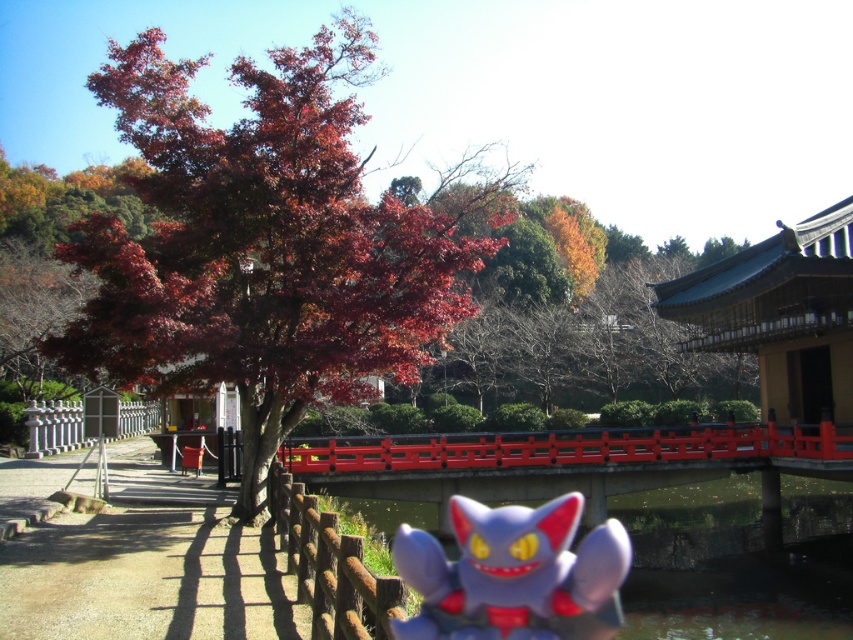
You are standing at the point marked by the coordinates point (x=514, y=573) in the image. What object are you standing on?

You are standing on the plush gray toy at center marked by the coordinates point (x=514, y=573).

You are a visitor walking along the path in the Japanese garden scene. You see the brown wooden fence at lower center and the white glossy fence at left. Which fence is positioned higher relative to your viewpoint?

The brown wooden fence at lower center is located above the white glossy fence at left, so it is positioned higher relative to your viewpoint.

You are a visitor in this Japanese garden and see the plush gray toy at center and the white glossy fence at left. Which object is positioned more to the east if the garden faces north?

The plush gray toy at center is positioned to the right of the white glossy fence at left. Since the garden faces north, right would correspond to the east direction. Therefore, the plush gray toy at center is more to the east.